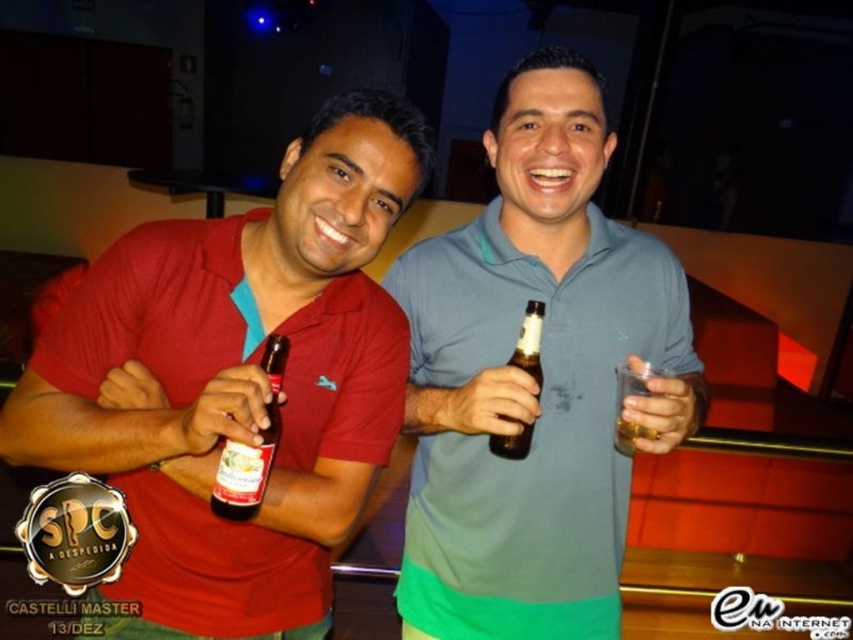
Question: Can you confirm if matte green polo shirt at center is positioned to the left of translucent glass at right?

Choices:
 (A) no
 (B) yes

Answer: (B)

Question: Which point is farther to the camera?

Choices:
 (A) coord(225,545)
 (B) coord(547,401)

Answer: (B)

Question: Which object is the closest to the matte red shirt at left?

Choices:
 (A) matte glass bottle at center
 (B) matte green polo shirt at center

Answer: (A)

Question: Is brown glass bottle at center thinner than translucent glass at right?

Choices:
 (A) yes
 (B) no

Answer: (A)

Question: Considering the real-world distances, which object is closest to the matte red shirt at left?

Choices:
 (A) translucent glass at right
 (B) matte green polo shirt at center
 (C) brown glass bottle at center

Answer: (B)

Question: Does matte glass bottle at center have a lesser width compared to translucent glass at right?

Choices:
 (A) no
 (B) yes

Answer: (A)